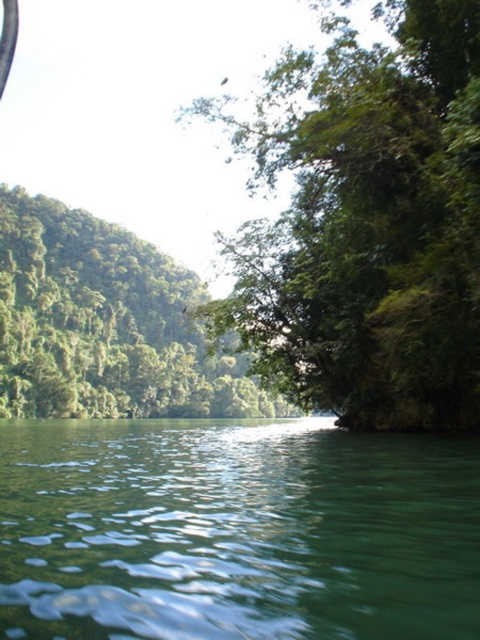
Question: Which object appears farthest from the camera in this image?

Choices:
 (A) green leafy tree at left
 (B) green smooth water at lower left
 (C) green leafy tree at center

Answer: (A)

Question: Does green smooth water at lower left appear over green leafy tree at left?

Choices:
 (A) no
 (B) yes

Answer: (A)

Question: Which of the following is the farthest from the observer?

Choices:
 (A) green leafy tree at center
 (B) green leafy tree at left
 (C) green smooth water at lower left

Answer: (B)

Question: Which point is farther from the camera taking this photo?

Choices:
 (A) coord(245,460)
 (B) coord(207,397)

Answer: (B)

Question: Is green leafy tree at center in front of green leafy tree at left?

Choices:
 (A) yes
 (B) no

Answer: (A)

Question: Does green leafy tree at center come in front of green leafy tree at left?

Choices:
 (A) yes
 (B) no

Answer: (A)